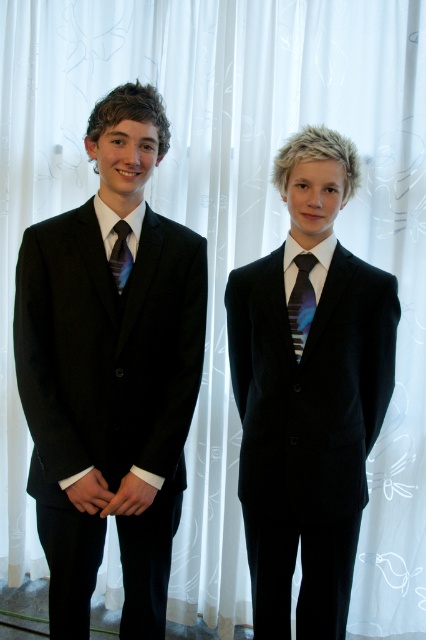
Which is in front, point (299, 612) or point (118, 230)?

Point (118, 230) is in front.

Does matte black suit at center appear on the left side of matte black tie at left?

Incorrect, matte black suit at center is not on the left side of matte black tie at left.

At what (x,y) coordinates should I click in order to perform the action: click on matte black suit at center. Please return your answer as a coordinate pair (x, y). The width and height of the screenshot is (426, 640). Looking at the image, I should click on (308, 396).

Does shiny blue tie at center lie in front of matte black tie at left?

That is False.

Which is more to the left, shiny blue tie at center or matte black tie at left?

Answer: matte black tie at left

Who is more distant from viewer, (310, 266) or (121, 257)?

The point (310, 266) is more distant.

The height and width of the screenshot is (640, 426). I want to click on shiny blue tie at center, so click(302, 301).

Does point (339, 586) come behind point (302, 308)?

Yes, it is behind point (302, 308).

Which is in front, point (242, 317) or point (296, 355)?

Positioned in front is point (296, 355).

The width and height of the screenshot is (426, 640). Find the location of `matte black suit at center`. matte black suit at center is located at coordinates point(308,396).